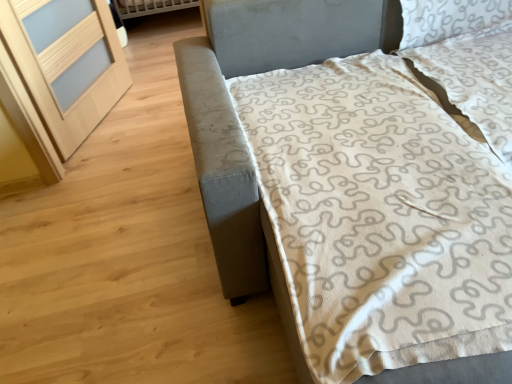
Question: Should I look upward or downward to see white textured pillow at upper right?

Choices:
 (A) up
 (B) down

Answer: (A)

Question: Does light wood screen door at left have a greater height compared to textured gray bed at right?

Choices:
 (A) yes
 (B) no

Answer: (A)

Question: From a real-world perspective, does light wood screen door at left stand above textured gray bed at right?

Choices:
 (A) no
 (B) yes

Answer: (B)

Question: Does light wood screen door at left have a lesser height compared to textured gray bed at right?

Choices:
 (A) yes
 (B) no

Answer: (B)

Question: Is light wood screen door at left next to textured gray bed at right and touching it?

Choices:
 (A) no
 (B) yes

Answer: (A)

Question: From a real-world perspective, does light wood screen door at left sit lower than textured gray bed at right?

Choices:
 (A) yes
 (B) no

Answer: (B)

Question: Can you confirm if light wood screen door at left is thinner than textured gray bed at right?

Choices:
 (A) yes
 (B) no

Answer: (A)

Question: Can you confirm if light wood screen door at left is shorter than white textured pillow at upper right?

Choices:
 (A) yes
 (B) no

Answer: (B)

Question: Is light wood screen door at left not within white textured pillow at upper right?

Choices:
 (A) yes
 (B) no

Answer: (A)

Question: Can white textured pillow at upper right be found inside light wood screen door at left?

Choices:
 (A) yes
 (B) no

Answer: (B)

Question: Considering the relative positions of light wood screen door at left and white textured pillow at upper right in the image provided, is light wood screen door at left to the left of white textured pillow at upper right from the viewer's perspective?

Choices:
 (A) no
 (B) yes

Answer: (B)

Question: Is light wood screen door at left looking in the opposite direction of white textured pillow at upper right?

Choices:
 (A) yes
 (B) no

Answer: (B)

Question: Considering the relative positions of light wood screen door at left and white textured pillow at upper right in the image provided, is light wood screen door at left behind white textured pillow at upper right?

Choices:
 (A) yes
 (B) no

Answer: (A)

Question: Is white textured pillow at upper right at the left side of textured gray bed at right?

Choices:
 (A) yes
 (B) no

Answer: (B)